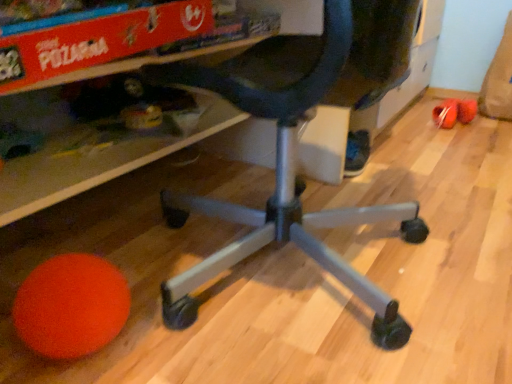
Locate an element on the screen. Image resolution: width=512 pixels, height=384 pixels. vacant space situated on the left part of rubberized plastic ball at lower left is located at coordinates (413, 128).